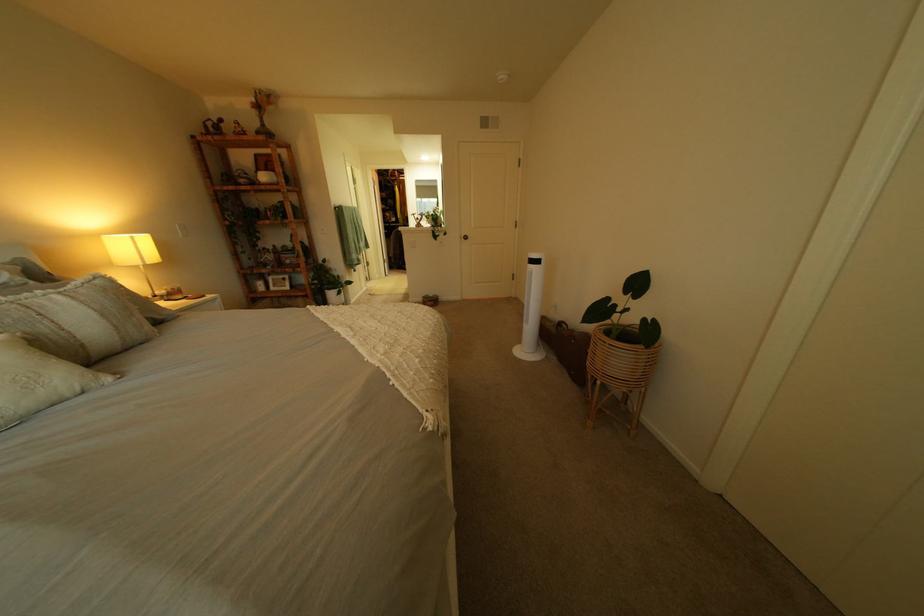
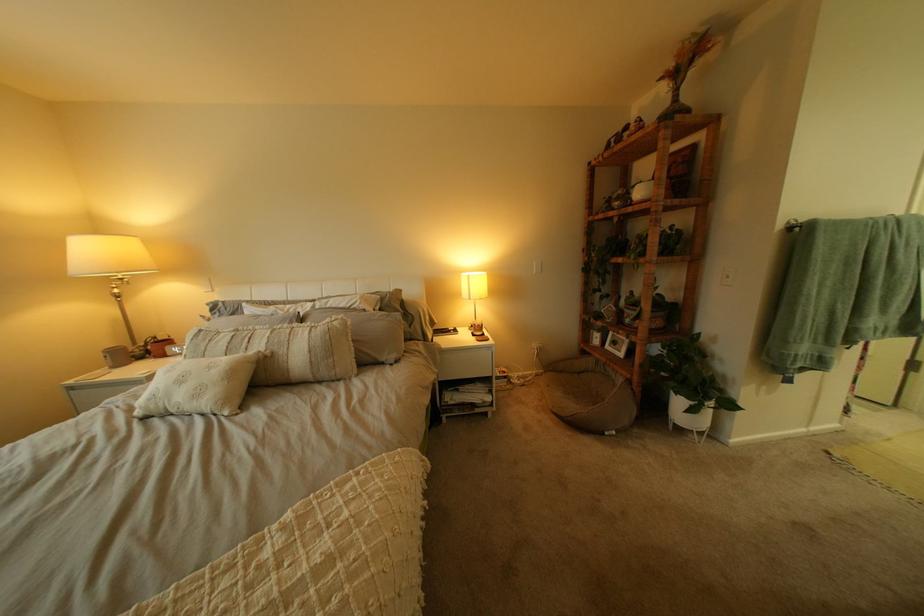
In the second image, find the point that corresponds to point 287,290 in the first image.

(623, 347)